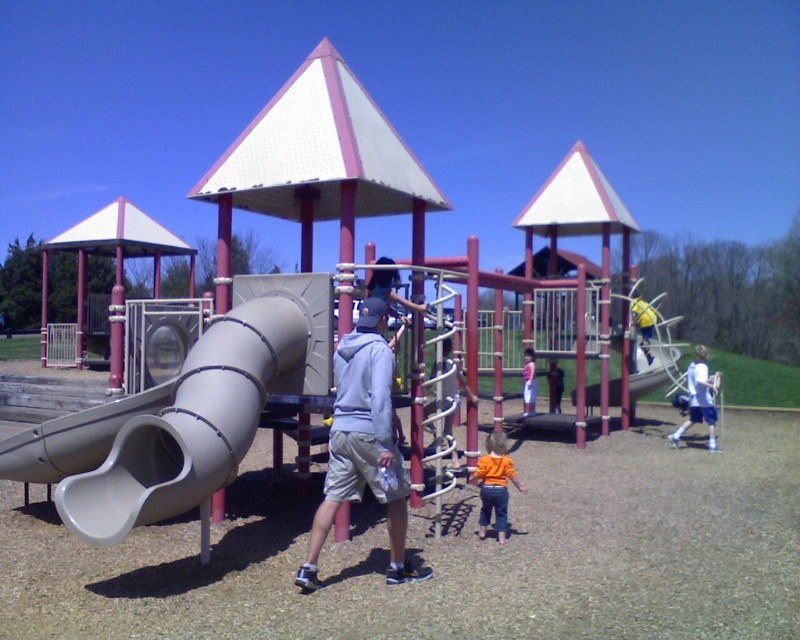
You are standing at the playground and see two children wearing the orange cotton shirt at center and the pink fabric dress at center. Which child is closer to you?

The orange cotton shirt at center is closer to the viewer than the pink fabric dress at center, so the child wearing the orange cotton shirt at center is closer to you.